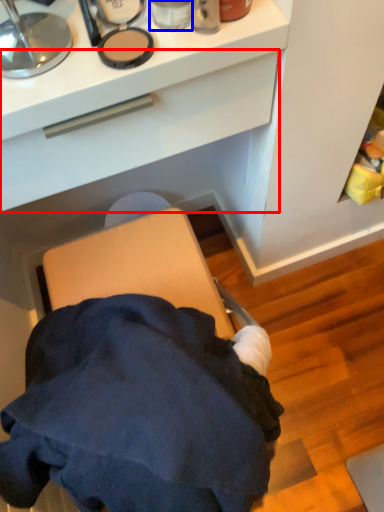
Question: Among these objects, which one is nearest to the camera, drawer (highlighted by a red box) or toiletry (highlighted by a blue box)?

Choices:
 (A) drawer
 (B) toiletry

Answer: (A)